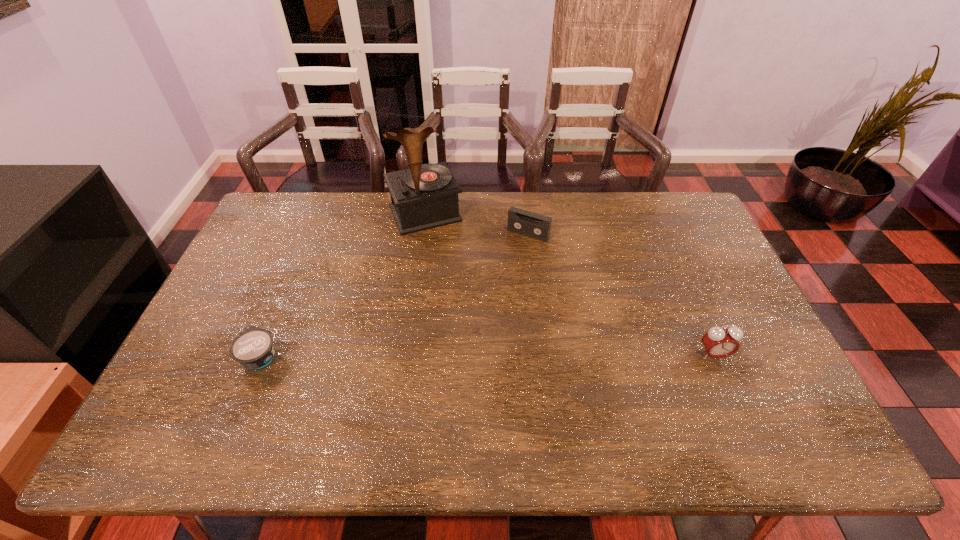
Identify the location of the shortest object. This screenshot has height=540, width=960. (253, 348).

You are a GUI agent. You are given a task and a screenshot of the screen. Output one action in this format:
    pyautogui.click(x=<x>, y=<y>)
    Task: Click on the leftmost object
    The width and height of the screenshot is (960, 540).
    Given the screenshot: What is the action you would take?
    pyautogui.click(x=253, y=348)

At what (x,y) coordinates should I click in order to perform the action: click on alarm clock. Please return your answer as a coordinate pair (x, y). The width and height of the screenshot is (960, 540). Looking at the image, I should click on (719, 342).

Where is `the second tallest object`? The image size is (960, 540). the second tallest object is located at coordinates (719, 342).

Identify the location of the third object from left to right. (520, 221).

Where is `the third tallest object`? The height and width of the screenshot is (540, 960). the third tallest object is located at coordinates (520, 221).

This screenshot has height=540, width=960. I want to click on phonograph_record, so click(x=425, y=196).

This screenshot has width=960, height=540. Find the location of `the tallest object`. the tallest object is located at coordinates (425, 196).

Identify the location of vacant region located 0.310m on the right of the shortest object. Image resolution: width=960 pixels, height=540 pixels. (398, 356).

This screenshot has height=540, width=960. I want to click on vacant space located on the clock face of the third shortest object, so click(x=736, y=407).